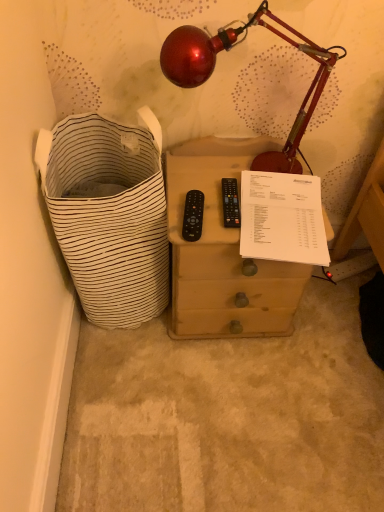
You are a GUI agent. You are given a task and a screenshot of the screen. Output one action in this format:
    pyautogui.click(x=<x>, y=<y>)
    Task: Click on the unoccupied region to the right of wooden nightstand at center
    The image size is (384, 512).
    Given the screenshot: What is the action you would take?
    pyautogui.click(x=328, y=332)